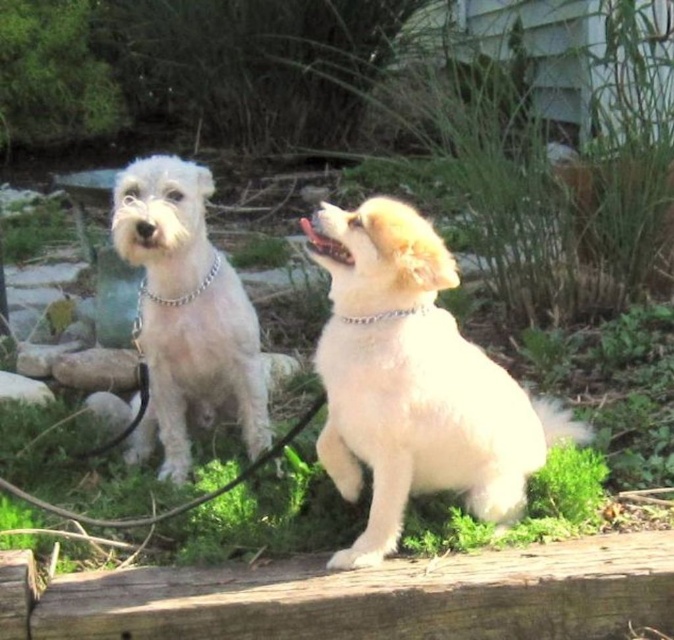
Which is behind, point (410, 241) or point (140, 304)?

The point (140, 304) is behind.

Between point (348, 374) and point (218, 268), which one is positioned in front?

Point (348, 374)

Where is `fluffy white dog at center`? This screenshot has height=640, width=674. fluffy white dog at center is located at coordinates (415, 381).

Who is shorter, silver chain at left or silver metallic chain at upper center?

Standing shorter between the two is silver metallic chain at upper center.

Can you confirm if silver chain at left is wider than silver metallic chain at upper center?

Yes.

Who is more forward, (156, 298) or (421, 308)?

Point (421, 308)

This screenshot has width=674, height=640. In order to click on silver chain at left in this screenshot , I will do `click(183, 292)`.

Does fluffy white dog at center appear over silver metallic chain at upper center?

No.

Based on the photo, can you confirm if fluffy white dog at center is thinner than silver metallic chain at upper center?

No.

Between point (373, 502) and point (394, 314), which one is positioned in front?

Positioned in front is point (394, 314).

This screenshot has height=640, width=674. I want to click on fluffy white dog at center, so click(415, 381).